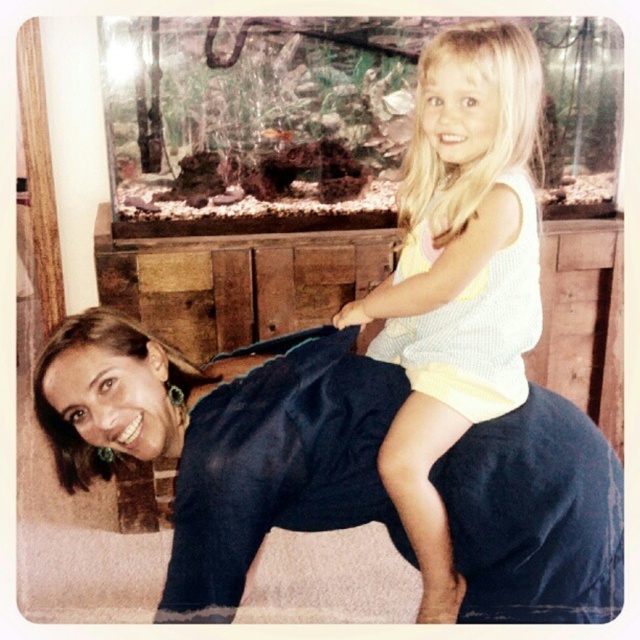
Is the position of dark blue fabric at center more distant than that of light yellow knit tank top at upper right?

That is False.

How distant is dark blue fabric at center from light yellow knit tank top at upper right?

dark blue fabric at center is 8.72 inches away from light yellow knit tank top at upper right.

Is point (189, 608) positioned in front of point (426, 372)?

Yes, point (189, 608) is in front of point (426, 372).

Locate an element on the screen. dark blue fabric at center is located at coordinates (225, 440).